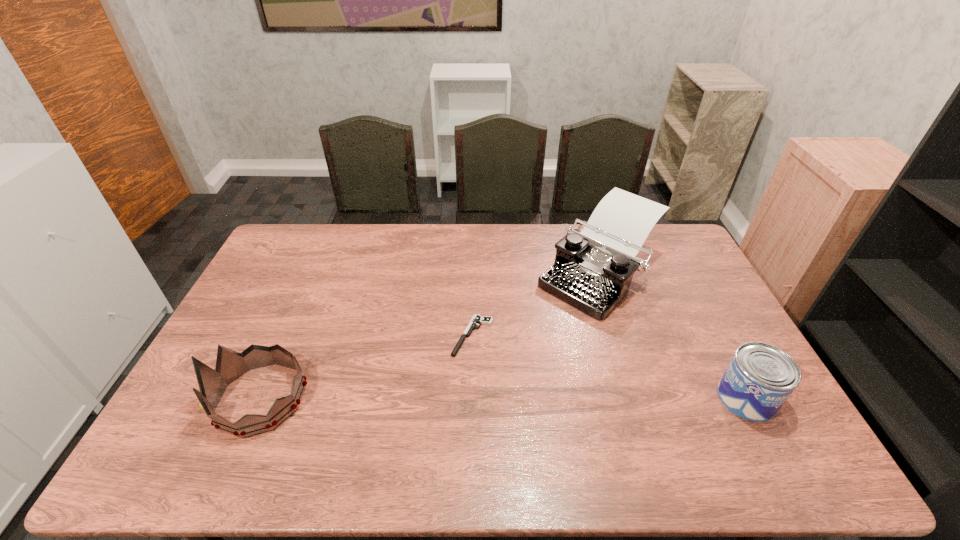
I want to click on tiara, so click(230, 365).

Identify the location of the leftmost object. The height and width of the screenshot is (540, 960). (230, 365).

This screenshot has width=960, height=540. In order to click on can in this screenshot , I will do `click(759, 379)`.

Where is `typewriter`? The width and height of the screenshot is (960, 540). typewriter is located at coordinates (593, 269).

Identify the location of pistol. (476, 319).

Locate an element on the screen. This screenshot has width=960, height=540. the shortest object is located at coordinates (476, 319).

At what (x,y) coordinates should I click in order to perform the action: click on vacant space located 0.220m on the keys of the typewriter. Please return your answer as a coordinate pair (x, y). Image resolution: width=960 pixels, height=540 pixels. Looking at the image, I should click on (522, 347).

Locate an element on the screen. vacant space located 0.240m on the keys of the typewriter is located at coordinates (518, 350).

Locate an element on the screen. This screenshot has width=960, height=540. free space located on the keys of the typewriter is located at coordinates (529, 341).

This screenshot has width=960, height=540. What are the coordinates of `free location located 0.190m on the front-facing side of the pistol` in the screenshot? It's located at (435, 409).